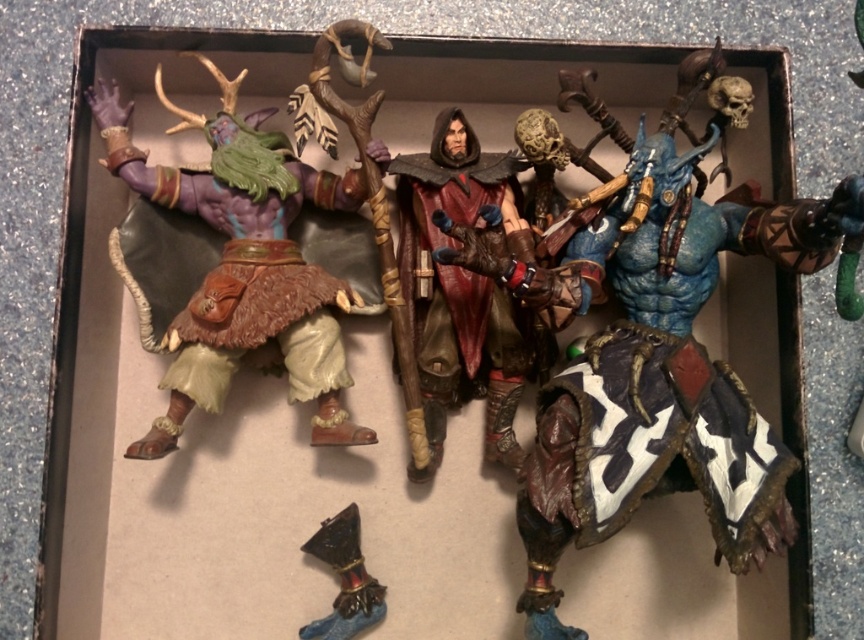
Consider the image. Where is the smooth brown cape at center located in the image?

The smooth brown cape at center is located at point (458, 289).

You are a delivery person standing 1 meter away from the cardboard box containing the action figures. You need to grab the smooth brown cape at center without moving the box. Can you reach it?

The smooth brown cape at center is 1.23 meters away from the camera. Since you are standing 1 meter away from the box, you cannot reach the smooth brown cape at center as it is further away than your current position.

You are a delivery person who needs to place a new action figure in the box. The new figure must be placed between the two points, point A at point (316, 198) and point B at point (340, 636). Which point should you place the new figure closer to in order to ensure it is closer to the front of the box?

To place the new figure closer to the front of the box, you should position it closer to point A at point (316, 198) since it is closer to the viewer than point B at point (340, 636).